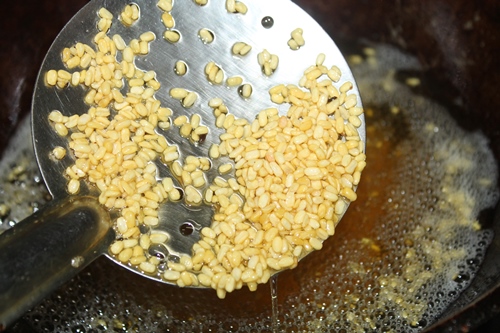
Locate an element on the screen. The height and width of the screenshot is (333, 500). gray tray is located at coordinates (495, 279).